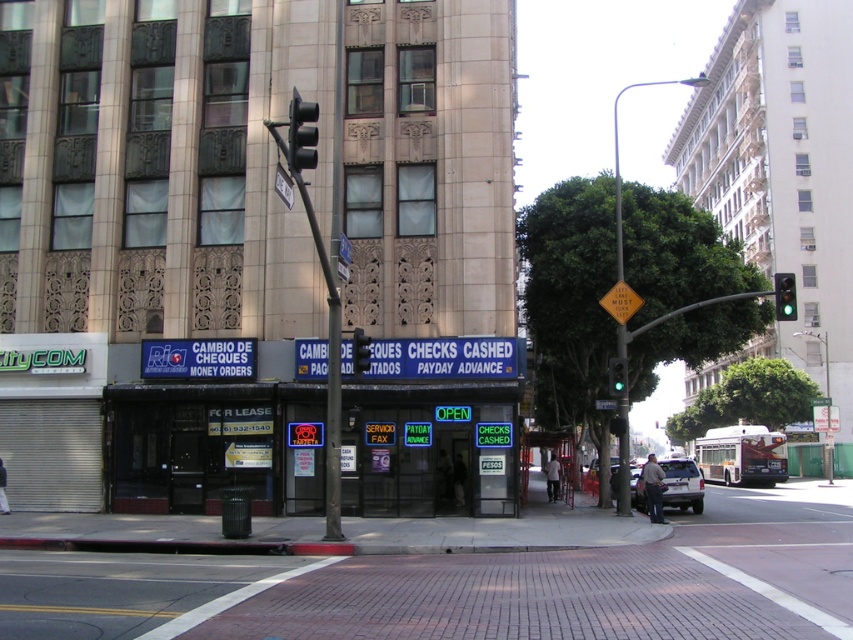
You are a pedestrian standing at the crosswalk. You need to cross the street but want to ensure you can reach the other side before the traffic light changes. The distance between the green glass traffic light at upper right and the metallic traffic light at center is 32.24 feet. If your walking speed is 3 feet per second, how many seconds do you have before the lights turn red?

The distance between the green glass traffic light at upper right and the metallic traffic light at center is 32.24 feet. At a walking speed of 3 feet per second, it would take approximately 10.75 seconds to cover the distance. However, the exact time before the lights turn red isnecessary to determine the safe crossing time. Without knowing the traffic light cycle duration, it is impossible to calculate the remaining time before the lights change.

You are a pedestrian standing at the intersection and want to cross the street. You see two traffic lights ahead of you. Which traffic light is closer to you, the black plastic traffic light at upper center or the metallic traffic light at center?

The black plastic traffic light at upper center is closer to the viewer than the metallic traffic light at center, so it is the closer one.